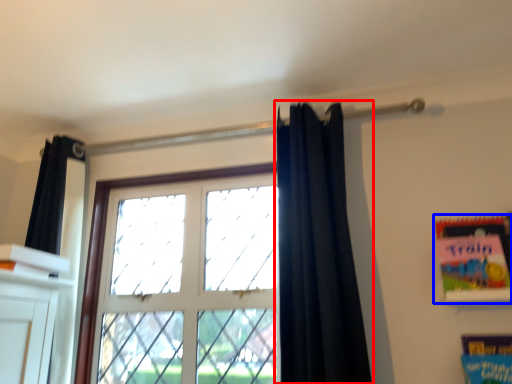
Question: Which object is closer to the camera taking this photo, curtain (highlighted by a red box) or paperback book (highlighted by a blue box)?

Choices:
 (A) curtain
 (B) paperback book

Answer: (A)